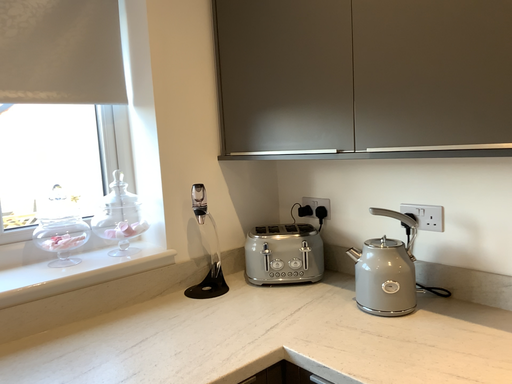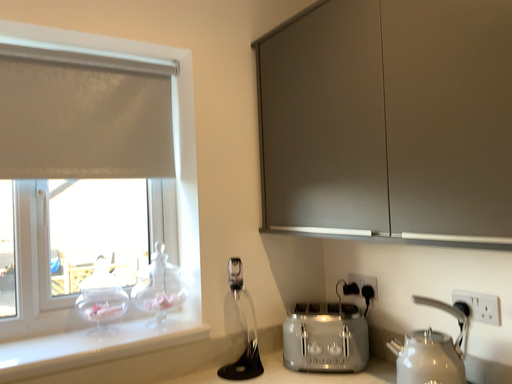
Question: Which way did the camera rotate in the video?

Choices:
 (A) rotated left
 (B) rotated right

Answer: (A)